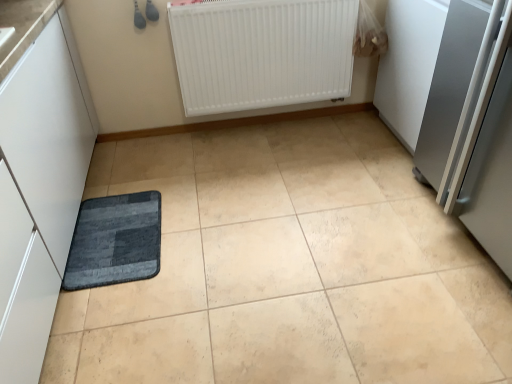
Question: Does white matte radiator at upper center have a larger size compared to dark gray textured mat at lower left?

Choices:
 (A) yes
 (B) no

Answer: (A)

Question: Could you tell me if white matte radiator at upper center is facing dark gray textured mat at lower left?

Choices:
 (A) yes
 (B) no

Answer: (A)

Question: Is dark gray textured mat at lower left surrounded by white matte radiator at upper center?

Choices:
 (A) yes
 (B) no

Answer: (B)

Question: From the image's perspective, does white matte radiator at upper center appear higher than dark gray textured mat at lower left?

Choices:
 (A) yes
 (B) no

Answer: (A)

Question: From the image's perspective, is white matte radiator at upper center beneath dark gray textured mat at lower left?

Choices:
 (A) no
 (B) yes

Answer: (A)

Question: From a real-world perspective, is white matte radiator at upper center physically below dark gray textured mat at lower left?

Choices:
 (A) no
 (B) yes

Answer: (A)

Question: From the image's perspective, would you say satin silver refrigerator at right is positioned over white matte radiator at upper center?

Choices:
 (A) yes
 (B) no

Answer: (B)

Question: Is satin silver refrigerator at right taller than white matte radiator at upper center?

Choices:
 (A) no
 (B) yes

Answer: (B)

Question: Does satin silver refrigerator at right lie behind white matte radiator at upper center?

Choices:
 (A) no
 (B) yes

Answer: (A)

Question: Is satin silver refrigerator at right at the left side of white matte radiator at upper center?

Choices:
 (A) no
 (B) yes

Answer: (A)

Question: From the image's perspective, is satin silver refrigerator at right beneath white matte radiator at upper center?

Choices:
 (A) no
 (B) yes

Answer: (B)

Question: Considering the relative sizes of satin silver refrigerator at right and white matte radiator at upper center in the image provided, is satin silver refrigerator at right smaller than white matte radiator at upper center?

Choices:
 (A) no
 (B) yes

Answer: (A)

Question: From a real-world perspective, is white matte radiator at upper center located higher than satin silver refrigerator at right?

Choices:
 (A) yes
 (B) no

Answer: (B)